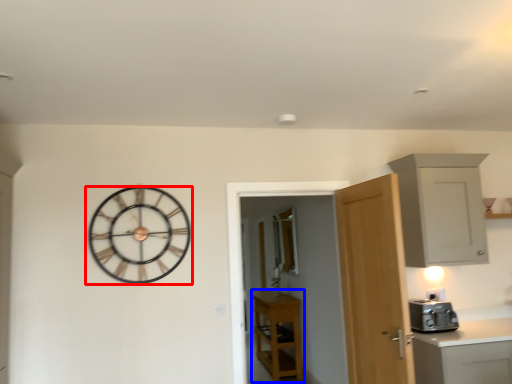
Question: Which of the following is the closest to the observer, wall clock (highlighted by a red box) or cabinetry (highlighted by a blue box)?

Choices:
 (A) wall clock
 (B) cabinetry

Answer: (A)